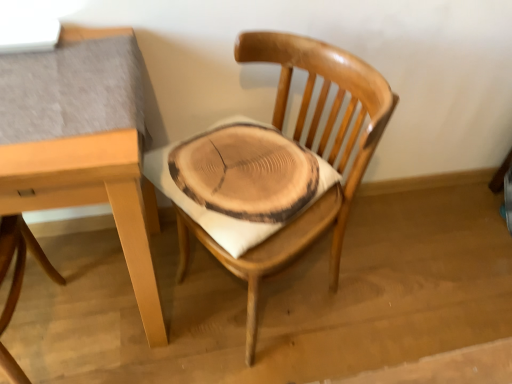
Question: Can you confirm if light brown wood table at upper left is taller than wooden chair at center, which appears as the second chair when viewed from the left?

Choices:
 (A) no
 (B) yes

Answer: (A)

Question: From a real-world perspective, is light brown wood table at upper left located beneath wooden chair at center, which appears as the second chair when viewed from the left?

Choices:
 (A) no
 (B) yes

Answer: (B)

Question: Is light brown wood table at upper left looking in the opposite direction of wooden chair at center, placed as the 1th chair when sorted from right to left?

Choices:
 (A) no
 (B) yes

Answer: (A)

Question: Does light brown wood table at upper left have a lesser width compared to wooden chair at center, placed as the 1th chair when sorted from right to left?

Choices:
 (A) no
 (B) yes

Answer: (A)

Question: Is light brown wood table at upper left positioned beyond the bounds of wooden chair at center, which appears as the second chair when viewed from the left?

Choices:
 (A) no
 (B) yes

Answer: (B)

Question: Is natural wood chair at center, which is the first chair from left to right, spatially inside light brown wood table at upper left, or outside of it?

Choices:
 (A) outside
 (B) inside

Answer: (B)

Question: From the image's perspective, is natural wood chair at center, which is the first chair from left to right, positioned above or below light brown wood table at upper left?

Choices:
 (A) below
 (B) above

Answer: (A)

Question: From their relative heights in the image, would you say natural wood chair at center, which is the first chair from left to right, is taller or shorter than light brown wood table at upper left?

Choices:
 (A) tall
 (B) short

Answer: (B)

Question: Is natural wood chair at center, which is the first chair from left to right, bigger or smaller than light brown wood table at upper left?

Choices:
 (A) small
 (B) big

Answer: (A)

Question: Is point (13, 286) positioned closer to the camera than point (334, 218)?

Choices:
 (A) farther
 (B) closer

Answer: (B)

Question: Looking at the image, does natural wood chair at center, positioned as the second chair in right-to-left order, seem bigger or smaller compared to wooden chair at center, placed as the 1th chair when sorted from right to left?

Choices:
 (A) big
 (B) small

Answer: (B)

Question: In terms of width, does natural wood chair at center, which is the first chair from left to right, look wider or thinner when compared to wooden chair at center, which appears as the second chair when viewed from the left?

Choices:
 (A) thin
 (B) wide

Answer: (A)

Question: From a real-world perspective, is natural wood chair at center, which is the first chair from left to right, above or below wooden chair at center, placed as the 1th chair when sorted from right to left?

Choices:
 (A) below
 (B) above

Answer: (A)

Question: Relative to wooden chair at center, which appears as the second chair when viewed from the left, is light brown wood table at upper left in front or behind?

Choices:
 (A) front
 (B) behind

Answer: (A)

Question: From the image's perspective, is light brown wood table at upper left above or below wooden chair at center, placed as the 1th chair when sorted from right to left?

Choices:
 (A) above
 (B) below

Answer: (B)